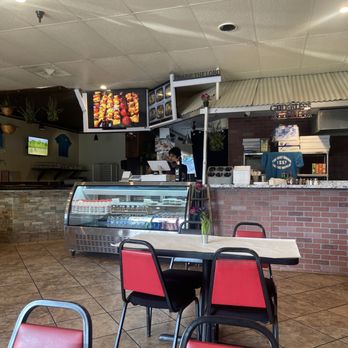
Where is `television screen`? This screenshot has height=348, width=348. television screen is located at coordinates (37, 146).